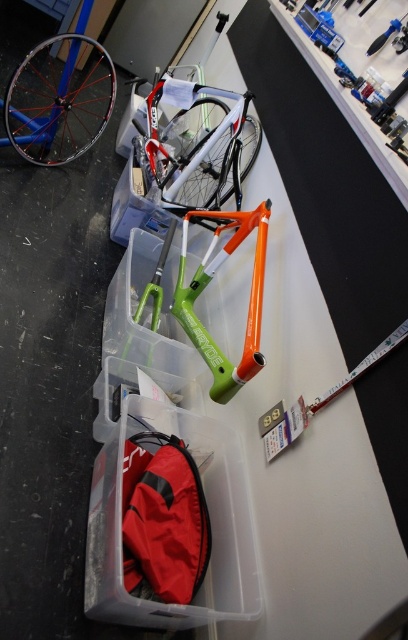
Question: Is matte white bicycle at upper center positioned in front of orange matte bicycle frame at center?

Choices:
 (A) yes
 (B) no

Answer: (B)

Question: In this image, where is matte white bicycle at upper center located relative to shiny silver rim at upper left?

Choices:
 (A) left
 (B) right

Answer: (B)

Question: Which object appears closest to the camera in this image?

Choices:
 (A) red fabric bag at lower left
 (B) transparent plastic bag at lower center

Answer: (B)

Question: Which object appears closest to the camera in this image?

Choices:
 (A) transparent plastic bag at lower center
 (B) matte white bicycle at upper center
 (C) red fabric bag at lower left

Answer: (A)

Question: Which point is farther from the camera taking this photo?

Choices:
 (A) (88, 49)
 (B) (163, 564)

Answer: (A)

Question: Does matte white bicycle at upper center appear under orange matte bicycle frame at center?

Choices:
 (A) yes
 (B) no

Answer: (B)